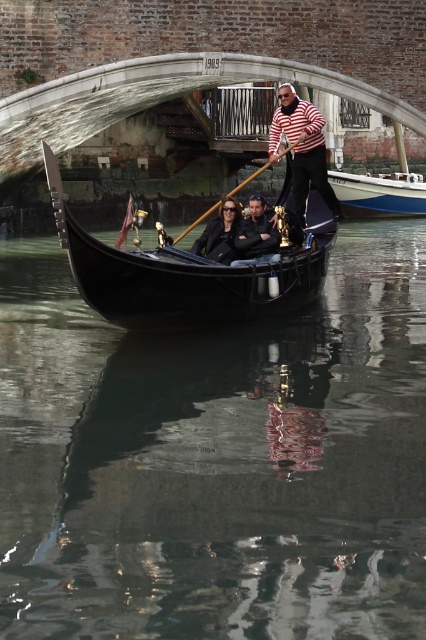
Question: Does black polished wood gondola at center appear on the right side of striped cotton shirt at center?

Choices:
 (A) no
 (B) yes

Answer: (A)

Question: Among these objects, which one is farthest from the camera?

Choices:
 (A) black leather jacket at center
 (B) striped cotton shirt at center
 (C) glossy black water at center

Answer: (B)

Question: Does striped cotton shirt at center appear on the right side of black leather jacket at center?

Choices:
 (A) yes
 (B) no

Answer: (A)

Question: Which object is closer to the camera taking this photo?

Choices:
 (A) concrete stone bridge at center
 (B) black polished wood gondola at center

Answer: (B)

Question: Which object appears farthest from the camera in this image?

Choices:
 (A) striped cotton shirt at center
 (B) blue polished wood boat at center
 (C) glossy black water at center

Answer: (B)

Question: Observing the image, what is the correct spatial positioning of striped cotton shirt at center in reference to blue polished wood boat at center?

Choices:
 (A) above
 (B) below

Answer: (A)